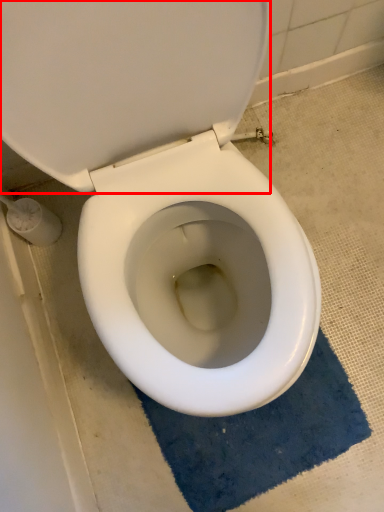
Question: From the image, what is the correct spatial relationship of back (annotated by the red box) in relation to bath mat?

Choices:
 (A) left
 (B) right

Answer: (A)